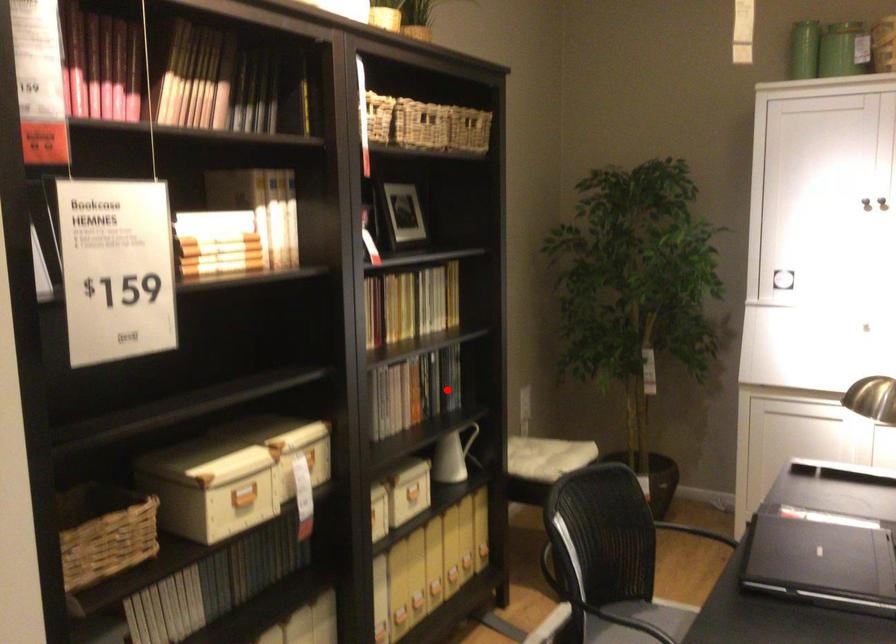
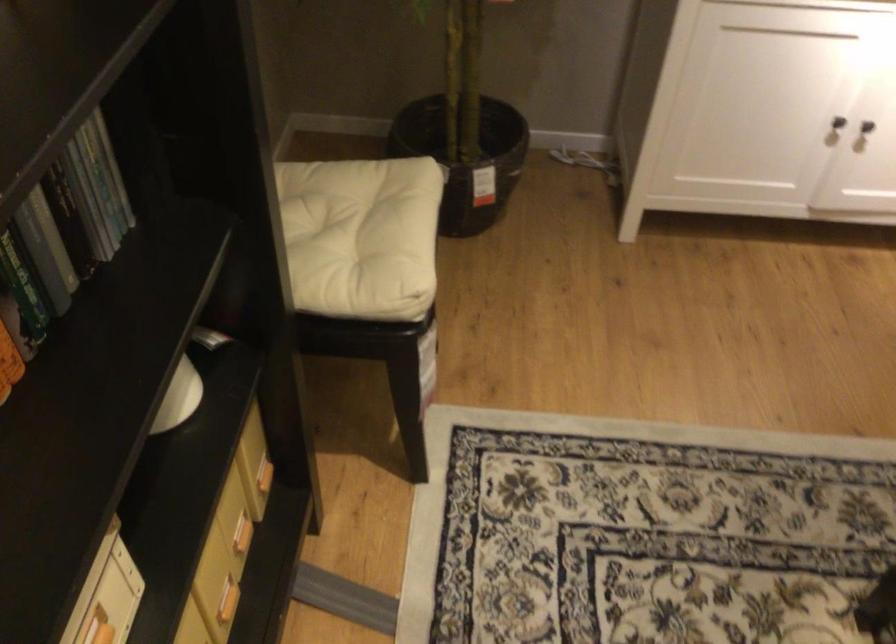
Question: I am providing you with two images of the same scene from different viewpoints. In image1, a red point is highlighted. Considering the same 3D point in image2, which of the following is correct?

Choices:
 (A) It is closer
 (B) It is farther

Answer: (A)